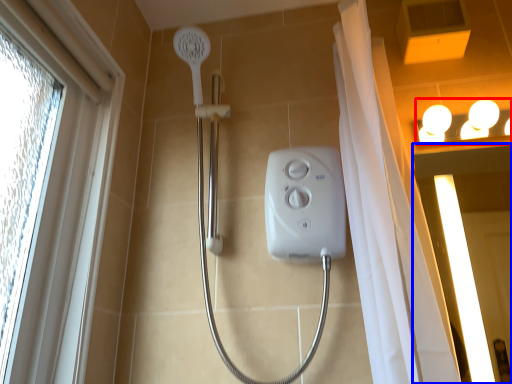
Question: Which object is closer to the camera taking this photo, light fixture (highlighted by a red box) or screen door (highlighted by a blue box)?

Choices:
 (A) light fixture
 (B) screen door

Answer: (B)